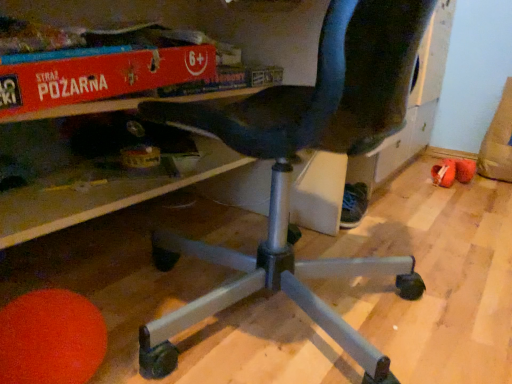
Where is `unoccupied area in front of black fabric shoe at lower center, the 1th footwear in the left-to-right sequence`? Image resolution: width=512 pixels, height=384 pixels. unoccupied area in front of black fabric shoe at lower center, the 1th footwear in the left-to-right sequence is located at coordinates (361, 241).